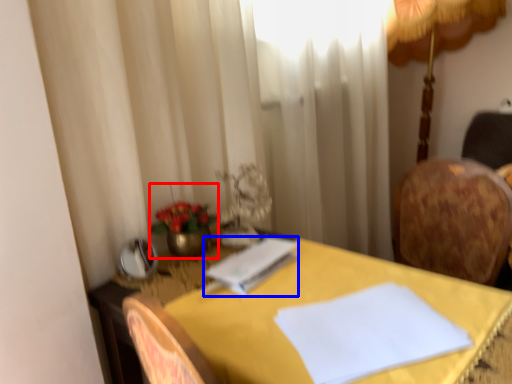
Question: Which of the following is the closest to the observer, floral arrangement (highlighted by a red box) or notepad (highlighted by a blue box)?

Choices:
 (A) floral arrangement
 (B) notepad

Answer: (B)